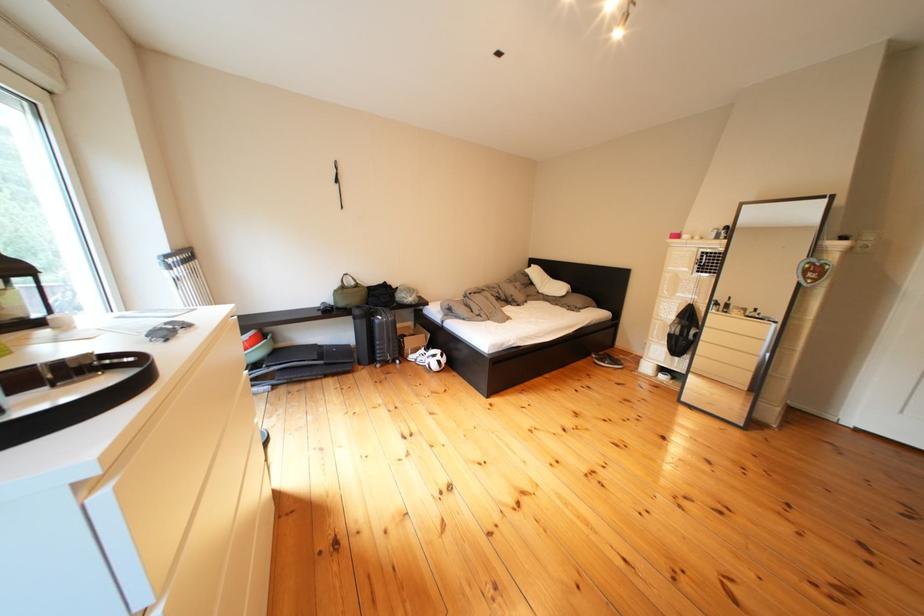
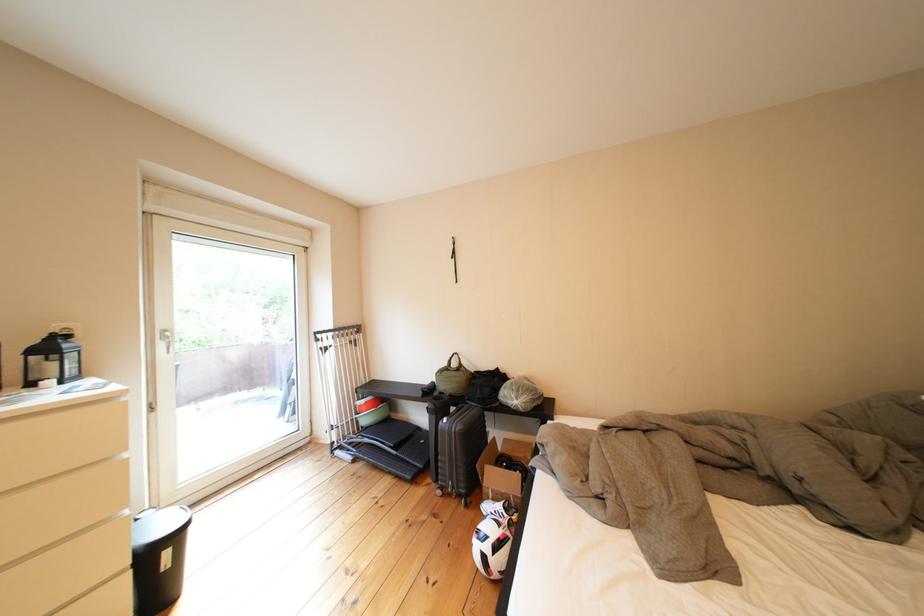
Where in the second image is the point corresponding to point 453,367 from the first image?

(499, 562)